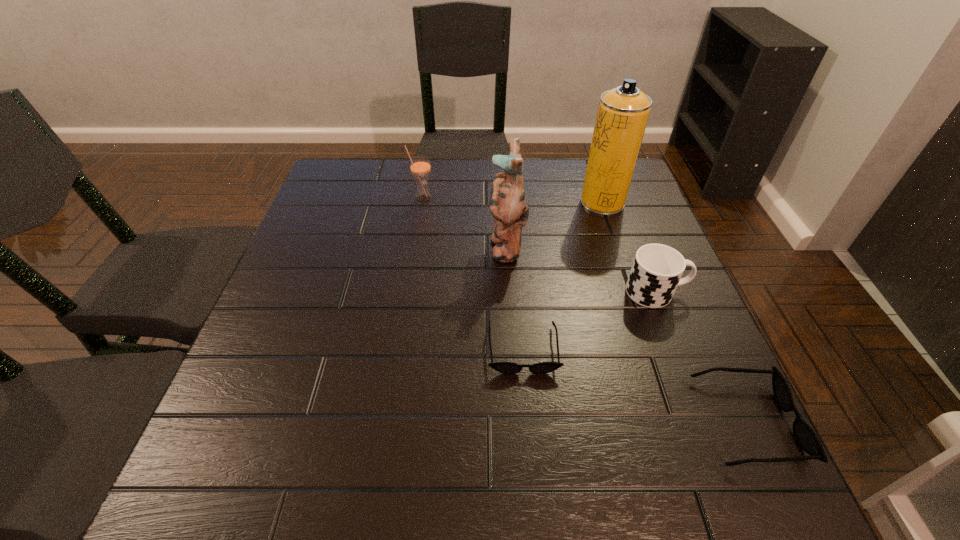
Find the location of a particular element. The image size is (960, 540). the fourth tallest object is located at coordinates (657, 269).

Find the location of `vacant space situated 0.090m on the front-facing side of the left sunglasses`. vacant space situated 0.090m on the front-facing side of the left sunglasses is located at coordinates (529, 418).

Locate an element on the screen. free spot located on the front of the fourth shortest object is located at coordinates point(408,292).

Where is `vacant region located 0.180m on the left of the tallest object`? This screenshot has height=540, width=960. vacant region located 0.180m on the left of the tallest object is located at coordinates (516, 202).

Where is `free space located on the front-facing side of the fourth nearest object`? This screenshot has height=540, width=960. free space located on the front-facing side of the fourth nearest object is located at coordinates (359, 246).

You are a GUI agent. You are given a task and a screenshot of the screen. Output one action in this format:
    pyautogui.click(x=<x>, y=<y>)
    Task: Click on the vacant space located on the front-facing side of the fourth nearest object
    The width and height of the screenshot is (960, 540).
    Given the screenshot: What is the action you would take?
    pyautogui.click(x=399, y=246)

The image size is (960, 540). Identify the location of free region located 0.280m on the front-facing side of the fourth nearest object. (375, 246).

This screenshot has width=960, height=540. In order to click on straw located in the far edge section of the desktop in this screenshot , I will do `click(420, 166)`.

You are a GUI agent. You are given a task and a screenshot of the screen. Output one action in this format:
    pyautogui.click(x=<x>, y=<y>)
    Task: Click on the aerosol can present at the far edge
    This screenshot has height=540, width=960.
    Given the screenshot: What is the action you would take?
    pyautogui.click(x=622, y=115)

Image resolution: width=960 pixels, height=540 pixels. What are the coordinates of `object at the near edge` in the screenshot? It's located at (806, 437).